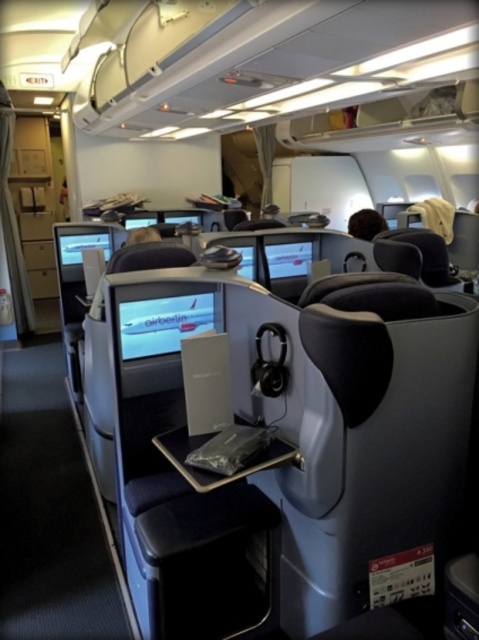
Question: Does white glossy airplane at center appear on the left side of brown fuzzy object at upper center?

Choices:
 (A) no
 (B) yes

Answer: (B)

Question: Does white glossy airplane at center lie behind brown fuzzy object at upper center?

Choices:
 (A) yes
 (B) no

Answer: (B)

Question: Which object is farther from the camera taking this photo?

Choices:
 (A) brown fuzzy object at upper center
 (B) white glossy airplane at center

Answer: (A)

Question: Which point is farther to the camera?

Choices:
 (A) brown fuzzy object at upper center
 (B) white glossy airplane at center

Answer: (A)

Question: Which point is farther to the camera?

Choices:
 (A) (171, 324)
 (B) (361, 227)

Answer: (B)

Question: Observing the image, what is the correct spatial positioning of white glossy airplane at center in reference to brown fuzzy object at upper center?

Choices:
 (A) above
 (B) below

Answer: (B)